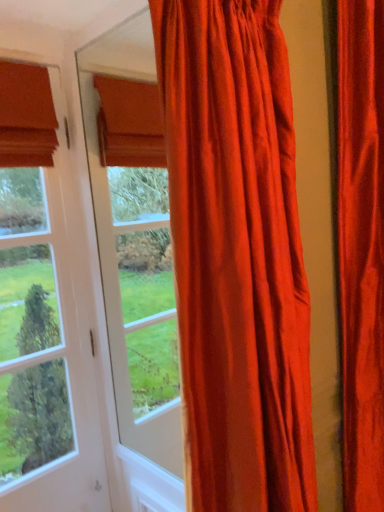
Measure the distance between clear glass door at left and camera.

clear glass door at left is 1.37 meters away from camera.

In order to click on clear glass door at left in this screenshot , I will do (x=59, y=333).

From the image's perspective, which one is positioned lower, satin orange curtain at center, which is counted as the second curtain, starting from the right, or clear glass door at left?

clear glass door at left appears lower in the image.

Which is closer to the camera, (213, 327) or (81, 301)?

The point (213, 327) is closer to the camera.

Considering the relative positions of satin orange curtain at center, which is counted as the second curtain, starting from the right, and clear glass door at left in the image provided, is satin orange curtain at center, which is counted as the second curtain, starting from the right, to the left of clear glass door at left from the viewer's perspective?

A: No.

Considering the sizes of objects clear glass door at left and satin orange curtain at center, which is counted as the second curtain, starting from the right, in the image provided, who is smaller, clear glass door at left or satin orange curtain at center, which is counted as the second curtain, starting from the right,?

Smaller between the two is clear glass door at left.

From the image's perspective, does clear glass door at left appear lower than satin orange curtain at center, which is the 1th curtain in left-to-right order?

Yes.

Consider the image. Is clear glass door at left not inside satin orange curtain at center, which is counted as the second curtain, starting from the right?

clear glass door at left is positioned outside satin orange curtain at center, which is counted as the second curtain, starting from the right.

How different are the orientations of clear glass door at left and satin orange curtain at center, which is the 1th curtain in left-to-right order, in degrees?

2.42 degrees separate the facing orientations of clear glass door at left and satin orange curtain at center, which is the 1th curtain in left-to-right order.

From the image's perspective, is clear glass door at left under satin red curtain at right, the first curtain when ordered from right to left?

Yes, from the image's perspective, clear glass door at left is below satin red curtain at right, the first curtain when ordered from right to left.

Is clear glass door at left placed right next to satin red curtain at right, the first curtain when ordered from right to left?

No, clear glass door at left is not in contact with satin red curtain at right, the first curtain when ordered from right to left.

Is satin red curtain at right, which is the second curtain in left-to-right order, inside clear glass door at left?

No.

Locate an element on the screen. This screenshot has height=512, width=384. the 2nd curtain to the right of the clear glass door at left, counting from the anchor's position is located at coordinates (361, 248).

From a real-world perspective, who is located higher, satin orange curtain at center, which is the 1th curtain in left-to-right order, or satin red curtain at right, the first curtain when ordered from right to left?

From a 3D spatial view, satin orange curtain at center, which is the 1th curtain in left-to-right order, is above.

Between satin orange curtain at center, which is the 1th curtain in left-to-right order, and satin red curtain at right, the first curtain when ordered from right to left, which one appears on the left side from the viewer's perspective?

From the viewer's perspective, satin orange curtain at center, which is the 1th curtain in left-to-right order, appears more on the left side.

Is satin red curtain at right, the first curtain when ordered from right to left, at the back of satin orange curtain at center, which is counted as the second curtain, starting from the right?

satin orange curtain at center, which is counted as the second curtain, starting from the right, does not have its back to satin red curtain at right, the first curtain when ordered from right to left.

From the image's perspective, which one is positioned lower, satin red curtain at right, the first curtain when ordered from right to left, or satin orange curtain at center, which is counted as the second curtain, starting from the right?

satin red curtain at right, the first curtain when ordered from right to left, is shown below in the image.

Is satin orange curtain at center, which is the 1th curtain in left-to-right order, at the back of satin red curtain at right, the first curtain when ordered from right to left?

satin red curtain at right, the first curtain when ordered from right to left, is not turned away from satin orange curtain at center, which is the 1th curtain in left-to-right order.

Which of these two, satin red curtain at right, the first curtain when ordered from right to left, or satin orange curtain at center, which is the 1th curtain in left-to-right order, stands shorter?

Standing shorter between the two is satin orange curtain at center, which is the 1th curtain in left-to-right order.

From the picture: Measure the distance from satin red curtain at right, the first curtain when ordered from right to left, to satin orange curtain at center, which is the 1th curtain in left-to-right order.

21.41 inches.

From the image's perspective, who appears lower, satin red curtain at right, the first curtain when ordered from right to left, or clear glass door at left?

clear glass door at left.

Looking at this image, between satin red curtain at right, which is the second curtain in left-to-right order, and clear glass door at left, which one has less height?

Standing shorter between the two is clear glass door at left.

From a real-world perspective, is satin red curtain at right, the first curtain when ordered from right to left, physically above clear glass door at left?

Yes, from a real-world perspective, satin red curtain at right, the first curtain when ordered from right to left, is over clear glass door at left

Looking at this image, between satin red curtain at right, which is the second curtain in left-to-right order, and clear glass door at left, which one appears on the left side from the viewer's perspective?

clear glass door at left.

The image size is (384, 512). What are the coordinates of `window below the satin orange curtain at center, which is counted as the second curtain, starting from the right (from the image's perspective)` in the screenshot? It's located at (59, 333).

There is a clear glass door at left. Where is `the 2nd curtain above it (from a real-world perspective)`? This screenshot has height=512, width=384. the 2nd curtain above it (from a real-world perspective) is located at coordinates (236, 255).

Based on their spatial positions, is satin red curtain at right, the first curtain when ordered from right to left, or clear glass door at left further from satin orange curtain at center, which is counted as the second curtain, starting from the right?

Based on the image, clear glass door at left appears to be further to satin orange curtain at center, which is counted as the second curtain, starting from the right.

From the image, which object appears to be nearer to satin red curtain at right, which is the second curtain in left-to-right order, satin orange curtain at center, which is the 1th curtain in left-to-right order, or clear glass door at left?

Based on the image, satin orange curtain at center, which is the 1th curtain in left-to-right order, appears to be nearer to satin red curtain at right, which is the second curtain in left-to-right order.

Based on their spatial positions, is satin orange curtain at center, which is the 1th curtain in left-to-right order, or satin red curtain at right, which is the second curtain in left-to-right order, closer to clear glass door at left?

satin orange curtain at center, which is the 1th curtain in left-to-right order.

Based on their spatial positions, is clear glass door at left or satin orange curtain at center, which is counted as the second curtain, starting from the right, closer to satin red curtain at right, which is the second curtain in left-to-right order?

Among the two, satin orange curtain at center, which is counted as the second curtain, starting from the right, is located nearer to satin red curtain at right, which is the second curtain in left-to-right order.

From the image, which object appears to be farther from clear glass door at left, satin red curtain at right, which is the second curtain in left-to-right order, or satin orange curtain at center, which is counted as the second curtain, starting from the right?

satin red curtain at right, which is the second curtain in left-to-right order, lies further to clear glass door at left than the other object.

From the image, which object appears to be nearer to satin orange curtain at center, which is counted as the second curtain, starting from the right, clear glass door at left or satin red curtain at right, which is the second curtain in left-to-right order?

satin red curtain at right, which is the second curtain in left-to-right order, is positioned closer to the anchor satin orange curtain at center, which is counted as the second curtain, starting from the right.

Where is `curtain between clear glass door at left and satin red curtain at right, which is the second curtain in left-to-right order`? The image size is (384, 512). curtain between clear glass door at left and satin red curtain at right, which is the second curtain in left-to-right order is located at coordinates (236, 255).